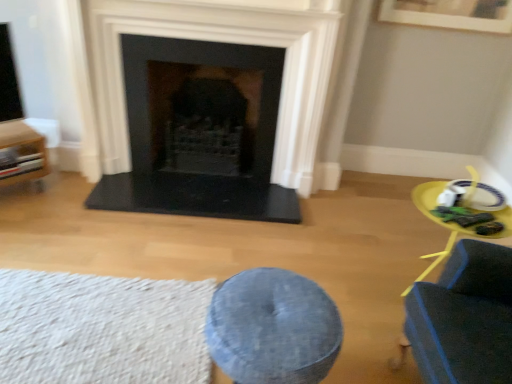
Question: Should I look upward or downward to see wooden cabinet at left?

Choices:
 (A) up
 (B) down

Answer: (A)

Question: Is denim cushion at center surrounding white textured rug at lower left?

Choices:
 (A) no
 (B) yes

Answer: (A)

Question: Is denim cushion at center to the right of white textured rug at lower left from the viewer's perspective?

Choices:
 (A) yes
 (B) no

Answer: (A)

Question: From a real-world perspective, is denim cushion at center located higher than white textured rug at lower left?

Choices:
 (A) yes
 (B) no

Answer: (A)

Question: From the image's perspective, is denim cushion at center under white textured rug at lower left?

Choices:
 (A) yes
 (B) no

Answer: (A)

Question: Does denim cushion at center come in front of white textured rug at lower left?

Choices:
 (A) no
 (B) yes

Answer: (B)

Question: Would you say denim cushion at center is a long distance from white textured rug at lower left?

Choices:
 (A) yes
 (B) no

Answer: (B)

Question: Is black stone fireplace at center looking in the opposite direction of denim cushion at center?

Choices:
 (A) yes
 (B) no

Answer: (B)

Question: Is black stone fireplace at center smaller than denim cushion at center?

Choices:
 (A) no
 (B) yes

Answer: (A)

Question: From the image's perspective, does black stone fireplace at center appear higher than denim cushion at center?

Choices:
 (A) yes
 (B) no

Answer: (A)

Question: Does black stone fireplace at center have a greater width compared to denim cushion at center?

Choices:
 (A) no
 (B) yes

Answer: (A)

Question: From the image's perspective, is black stone fireplace at center located beneath denim cushion at center?

Choices:
 (A) no
 (B) yes

Answer: (A)

Question: Considering the relative positions of black stone fireplace at center and denim cushion at center in the image provided, is black stone fireplace at center behind denim cushion at center?

Choices:
 (A) yes
 (B) no

Answer: (A)

Question: From a real-world perspective, does black stone fireplace at center sit lower than wooden cabinet at left?

Choices:
 (A) no
 (B) yes

Answer: (A)